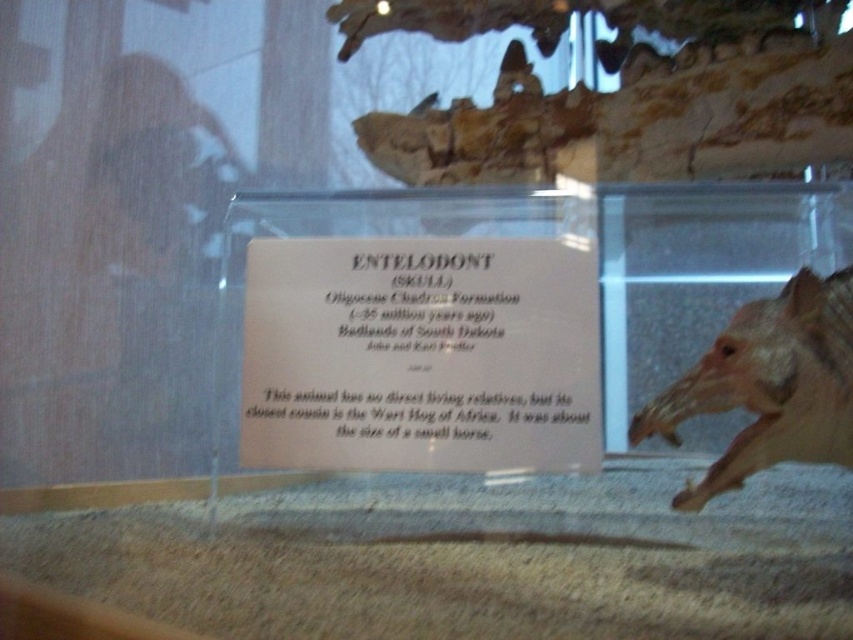
You are standing in front of the museum display case. There are two points marked on the display case. The first point is at location point(396,385) and the second point is at point(740,481). If you want to touch the first point without moving your hand from the second point, is it possible?

Point(396,385) is behind point(740,481), so you cannot touch the first point without moving your hand from the second point because it is obscured by the display case.